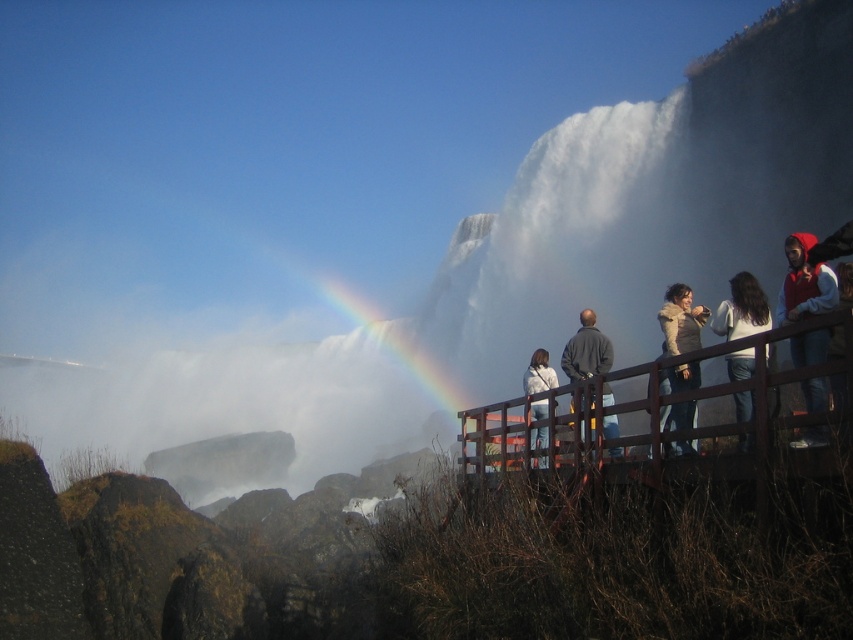
Question: Which object is farther from the camera taking this photo?

Choices:
 (A) white matte jacket at upper right
 (B) red knit hat at upper right
 (C) brown wooden rail at right

Answer: (A)

Question: Does brown wooden rail at right have a lesser width compared to white fleece jacket at upper center?

Choices:
 (A) no
 (B) yes

Answer: (A)

Question: Does white matte jacket at upper right appear on the left side of light brown fur coat at center?

Choices:
 (A) no
 (B) yes

Answer: (A)

Question: Is white matte jacket at upper right positioned before dark gray jacket at center?

Choices:
 (A) yes
 (B) no

Answer: (A)

Question: Which point is closer to the camera taking this photo?

Choices:
 (A) (489, 419)
 (B) (791, 316)
 (C) (741, 400)
 (D) (585, 340)

Answer: (C)

Question: Which of the following is the farthest from the observer?

Choices:
 (A) light brown fur coat at center
 (B) red knit hat at upper right
 (C) white matte jacket at upper right
 (D) brown wooden rail at right

Answer: (A)